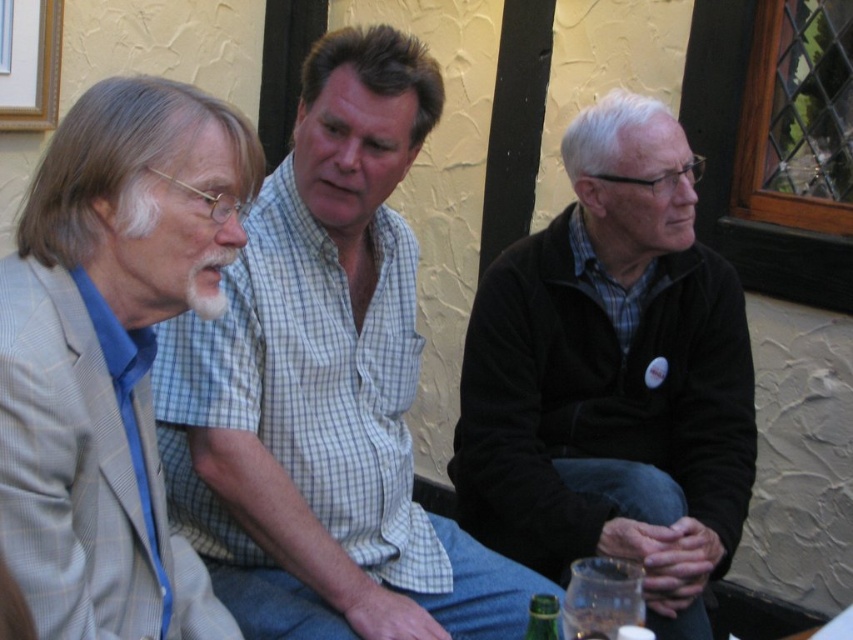
Is light brown checkered shirt at center in front of brushed metal picture frame at upper left?

Yes.

Does point (212, 499) come closer to viewer compared to point (19, 45)?

That is True.

This screenshot has height=640, width=853. Identify the location of light brown checkered shirt at center. (326, 387).

Where is `light brown checkered shirt at center`? This screenshot has width=853, height=640. light brown checkered shirt at center is located at coordinates (326, 387).

Between point (614, 310) and point (39, 36), which one is positioned in front?

Point (614, 310) is in front.

Is black fleece jacket at center shorter than brushed metal picture frame at upper left?

In fact, black fleece jacket at center may be taller than brushed metal picture frame at upper left.

Is point (576, 444) more distant than point (15, 8)?

No, (576, 444) is in front of (15, 8).

The width and height of the screenshot is (853, 640). I want to click on black fleece jacket at center, so click(612, 376).

Can you confirm if black fleece jacket at center is positioned to the left of light gray suit at left?

No, black fleece jacket at center is not to the left of light gray suit at left.

Is black fleece jacket at center wider than light gray suit at left?

Yes, black fleece jacket at center is wider than light gray suit at left.

Who is more forward, (640, 196) or (105, 477)?

Point (105, 477) is more forward.

The height and width of the screenshot is (640, 853). Find the location of `black fleece jacket at center`. black fleece jacket at center is located at coordinates tap(612, 376).